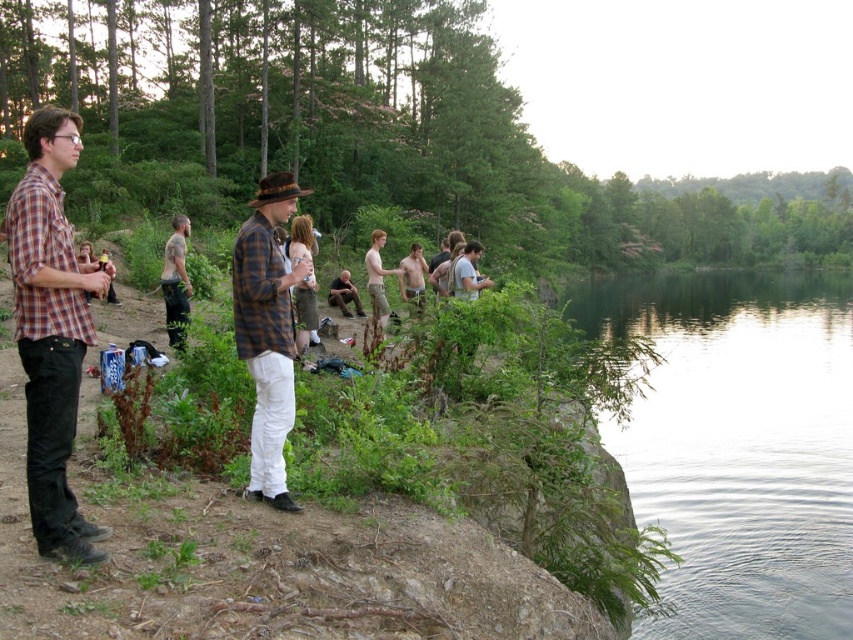
Is matte plaid shirt at left positioned before plaid fabric shirt at center?

That is True.

Between matte plaid shirt at left and plaid fabric shirt at center, which one is positioned lower?

plaid fabric shirt at center is lower down.

This screenshot has width=853, height=640. I want to click on matte plaid shirt at left, so click(x=51, y=330).

Which of these two, green smooth water at lower right or brown felt cowboy hat at center, stands shorter?

green smooth water at lower right is shorter.

This screenshot has height=640, width=853. I want to click on green smooth water at lower right, so click(740, 445).

This screenshot has width=853, height=640. Identify the location of green smooth water at lower right. (740, 445).

Can you confirm if light brown cotton shorts at center is positioned below brown felt cowboy hat at center?

Indeed, light brown cotton shorts at center is positioned under brown felt cowboy hat at center.

From the picture: Is light brown cotton shorts at center positioned at the back of brown felt cowboy hat at center?

Yes, light brown cotton shorts at center is behind brown felt cowboy hat at center.

At what (x,y) coordinates should I click in order to perform the action: click on light brown cotton shorts at center. Please return your answer as a coordinate pair (x, y). This screenshot has height=640, width=853. Looking at the image, I should click on (378, 276).

Find the location of a particular element. This screenshot has height=640, width=853. light brown cotton shorts at center is located at coordinates (378, 276).